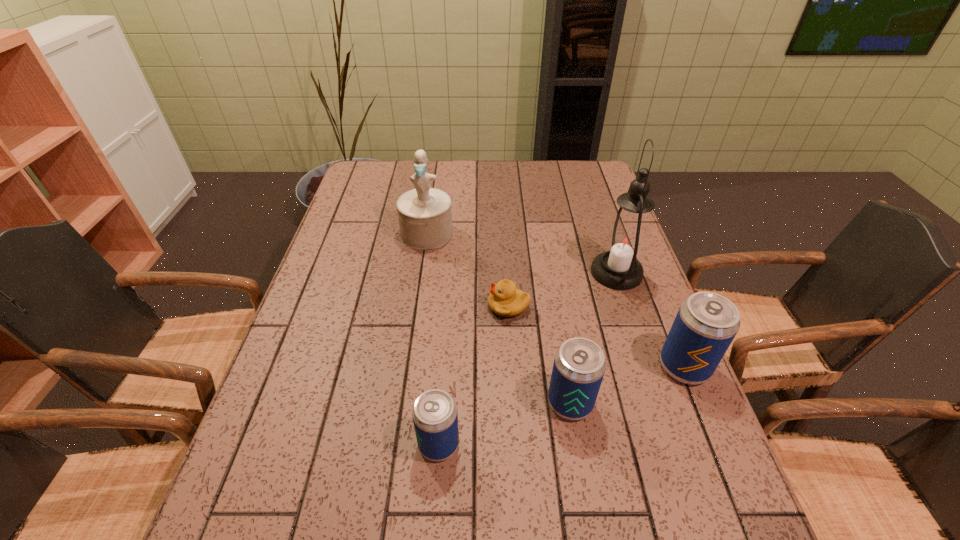
Find the location of a particular element. Image resolution: width=960 pixels, height=540 pixels. free space between the shortest beer can and the fourth object from left to right is located at coordinates (504, 423).

You are a GUI agent. You are given a task and a screenshot of the screen. Output one action in this format:
    pyautogui.click(x=<x>, y=<y>)
    Task: Click on the vacant region between the nearest object and the oil lamp
    The height and width of the screenshot is (540, 960).
    Given the screenshot: What is the action you would take?
    pyautogui.click(x=528, y=358)

Identify the location of free space that is in between the fifth shortest object and the nearest beer can. click(433, 339).

I want to click on vacant area that lies between the second beer can from right to left and the second tallest object, so click(x=498, y=318).

This screenshot has width=960, height=540. In order to click on free space between the duckling and the second shortest object in this screenshot , I will do `click(473, 375)`.

This screenshot has height=540, width=960. Find the location of `free area in between the third shortest object and the leftmost beer can`. free area in between the third shortest object and the leftmost beer can is located at coordinates (504, 423).

The image size is (960, 540). Find the location of `free spot between the farthest object and the second beer can from left to right`. free spot between the farthest object and the second beer can from left to right is located at coordinates (498, 318).

Identify which object is located as the third nearest to the farthest object. Please provide its 2D coordinates. Your answer should be formatted as a tuple, i.e. [(x, y)], where the tuple contains the x and y coordinates of a point satisfying the conditions above.

[(579, 365)]

Choose which object is the fourth nearest neighbor to the second beer can from right to left. Please provide its 2D coordinates. Your answer should be formatted as a tuple, i.e. [(x, y)], where the tuple contains the x and y coordinates of a point satisfying the conditions above.

[(625, 241)]

Identify which beer can is the nearest to the rightmost beer can. Please provide its 2D coordinates. Your answer should be formatted as a tuple, i.e. [(x, y)], where the tuple contains the x and y coordinates of a point satisfying the conditions above.

[(579, 365)]